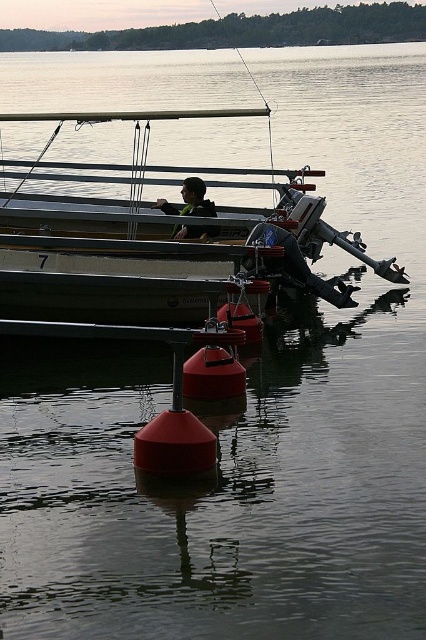
In the scene shown: Is white matte boat at center in front of matte black jacket at center?

Yes, white matte boat at center is closer to the viewer.

Based on the photo, who is more forward, (169, 305) or (196, 204)?

Point (169, 305) is in front.

Locate an element on the screen. The image size is (426, 640). white matte boat at center is located at coordinates (150, 232).